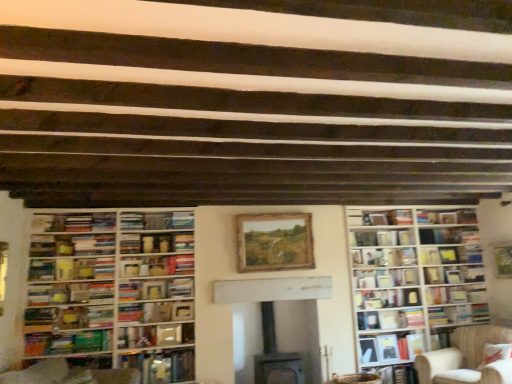
What do you see at coordinates (390, 347) in the screenshot? I see `hardcover book at lower right, placed as the 2th book when sorted from bottom to top` at bounding box center [390, 347].

Locate an element on the screen. Image resolution: width=512 pixels, height=384 pixels. hardcover book at lower right, which is the eleventh book in top-to-bottom order is located at coordinates (390, 347).

What are the coordinates of `beige fabric chair at lower right` in the screenshot? It's located at point(465,358).

Identify the location of wooden-framed painting at center, positioned as the 2th picture frame in right-to-left order. (274, 242).

You are a GUI agent. You are given a task and a screenshot of the screen. Output one action in this format:
    pyautogui.click(x=<x>, y=<y>)
    Task: Click on the hardcover book at lower right, placed as the 2th book when sorted from bottom to top
    
    Given the screenshot: What is the action you would take?
    pyautogui.click(x=390, y=347)

From a real-world perspective, which object stands above the other?

hardcover book at center, which is counted as the first book, starting from the top, is physically above.

Is hardcover book at center, acting as the 10th book starting from the bottom, placed right next to hardcover book at center, which is counted as the first book, starting from the top?

hardcover book at center, acting as the 10th book starting from the bottom, is not next to hardcover book at center, which is counted as the first book, starting from the top, and they're not touching.

Who is bigger, hardcover book at center, acting as the 10th book starting from the bottom, or hardcover book at center, which is counted as the first book, starting from the top?

hardcover book at center, acting as the 10th book starting from the bottom, is bigger.

What's the angular difference between hardcover book at center, acting as the 10th book starting from the bottom, and hardcover book at center, which is counted as the first book, starting from the top,'s facing directions?

They differ by 1.3 degrees in their facing directions.

Is hardcover book at center, arranged as the eighth book when ordered from the bottom, wider or thinner than multicolored paperbacks at lower left, marked as the 7th book in a top-to-bottom arrangement?

Considering their sizes, hardcover book at center, arranged as the eighth book when ordered from the bottom, looks slimmer than multicolored paperbacks at lower left, marked as the 7th book in a top-to-bottom arrangement.

From the image's perspective, is hardcover book at center, the fifth book from the top, positioned above or below multicolored paperbacks at lower left, marked as the 7th book in a top-to-bottom arrangement?

hardcover book at center, the fifth book from the top, is situated higher than multicolored paperbacks at lower left, marked as the 7th book in a top-to-bottom arrangement, in the image.

Is hardcover book at center, arranged as the eighth book when ordered from the bottom, beside multicolored paperbacks at lower left, the 6th book ordered from the bottom?

No, hardcover book at center, arranged as the eighth book when ordered from the bottom, is not next to multicolored paperbacks at lower left, the 6th book ordered from the bottom.

From a real-world perspective, which is physically above, hardcover book at center, the fifth book from the top, or multicolored paperbacks at lower left, the 6th book ordered from the bottom?

hardcover book at center, the fifth book from the top, from a real-world perspective.

I want to click on the 9th book to the left of the beige fabric chair at lower right, starting your count from the anchor, so click(132, 221).

From a real-world perspective, is hardcover book at center, which is counted as the first book, starting from the top, on beige fabric chair at lower right?

Yes, from a real-world perspective, hardcover book at center, which is counted as the first book, starting from the top, is over beige fabric chair at lower right

Which is less distant, (120, 226) or (460, 365)?

Point (120, 226).

Is hardcover book at center, which is counted as the first book, starting from the top, with beige fabric chair at lower right?

hardcover book at center, which is counted as the first book, starting from the top, and beige fabric chair at lower right are clearly separated.

How different are the orientations of wooden bookshelf at left, which appears as the second bookcase when viewed from the right, and hardcover book at lower right, which is the eleventh book in top-to-bottom order, in degrees?

5.98 degrees.

Identify the location of bookcase that is the 2nd one above the hardcover book at lower right, placed as the 2th book when sorted from bottom to top (from a real-world perspective). The width and height of the screenshot is (512, 384). (113, 292).

Could you tell me if wooden bookshelf at left, which appears as the second bookcase when viewed from the right, is facing hardcover book at lower right, placed as the 2th book when sorted from bottom to top?

No.

Is wooden bookshelf at left, acting as the 1th bookcase starting from the left, thinner than hardcover book at lower right, which is the eleventh book in top-to-bottom order?

In fact, wooden bookshelf at left, acting as the 1th bookcase starting from the left, might be wider than hardcover book at lower right, which is the eleventh book in top-to-bottom order.

Is hardcover book at lower right, which ranks as the 12th book in top-to-bottom order, positioned far away from wooden picture frame at center, the second picture frame viewed from the left?

Indeed, hardcover book at lower right, which ranks as the 12th book in top-to-bottom order, is not near wooden picture frame at center, the second picture frame viewed from the left.

Considering the sizes of hardcover book at lower right, which ranks as the 12th book in top-to-bottom order, and wooden picture frame at center, which ranks as the 1th picture frame in right-to-left order, in the image, is hardcover book at lower right, which ranks as the 12th book in top-to-bottom order, taller or shorter than wooden picture frame at center, which ranks as the 1th picture frame in right-to-left order,?

Clearly, hardcover book at lower right, which ranks as the 12th book in top-to-bottom order, is shorter compared to wooden picture frame at center, which ranks as the 1th picture frame in right-to-left order.

Does hardcover book at lower right, which ranks as the 12th book in top-to-bottom order, have a larger size compared to wooden picture frame at center, the second picture frame viewed from the left?

Yes, hardcover book at lower right, which ranks as the 12th book in top-to-bottom order, is bigger than wooden picture frame at center, the second picture frame viewed from the left.

Is hardcover book at lower right, placed as the first book when sorted from bottom to top, oriented away from wooden picture frame at center, which ranks as the 1th picture frame in right-to-left order?

hardcover book at lower right, placed as the first book when sorted from bottom to top, does not have its back to wooden picture frame at center, which ranks as the 1th picture frame in right-to-left order.

Is hardcover book at lower right, which is the eleventh book in top-to-bottom order, situated inside hardcover book at center, arranged as the eighth book when ordered from the bottom, or outside?

hardcover book at lower right, which is the eleventh book in top-to-bottom order, is not enclosed by hardcover book at center, arranged as the eighth book when ordered from the bottom.

From the image's perspective, is hardcover book at lower right, which is the eleventh book in top-to-bottom order, located above or below hardcover book at center, arranged as the eighth book when ordered from the bottom?

hardcover book at lower right, which is the eleventh book in top-to-bottom order, is below hardcover book at center, arranged as the eighth book when ordered from the bottom.

Which object is positioned more to the right, hardcover book at lower right, which is the eleventh book in top-to-bottom order, or hardcover book at center, arranged as the eighth book when ordered from the bottom?

Positioned to the right is hardcover book at lower right, which is the eleventh book in top-to-bottom order.

Considering the points (361, 337) and (401, 296), which point is in front, point (361, 337) or point (401, 296)?

The point (361, 337) is more forward.

Does hardcover book at lower right, placed as the first book when sorted from bottom to top, appear on the right side of white glossy bookcase at right, which appears as the second bookcase when viewed from the left?

No, hardcover book at lower right, placed as the first book when sorted from bottom to top, is not to the right of white glossy bookcase at right, which appears as the second bookcase when viewed from the left.

Which of these two, hardcover book at lower right, placed as the first book when sorted from bottom to top, or white glossy bookcase at right, which appears as the second bookcase when viewed from the left, is bigger?

white glossy bookcase at right, which appears as the second bookcase when viewed from the left.

Is hardcover book at lower right, which ranks as the 12th book in top-to-bottom order, not close to white glossy bookcase at right, positioned as the 1th bookcase in right-to-left order?

No, there isn't a large distance between hardcover book at lower right, which ranks as the 12th book in top-to-bottom order, and white glossy bookcase at right, positioned as the 1th bookcase in right-to-left order.

Identify the location of the 7th book behind the hardcover book at center, which is the 12th book in bottom-to-top order. The image size is (512, 384). [x=381, y=238].

There is a multicolored paperbacks at lower left, marked as the 7th book in a top-to-bottom arrangement. Where is `the 3rd book above it (from a real-world perspective)`? The image size is (512, 384). the 3rd book above it (from a real-world perspective) is located at coordinates (387, 298).

Considering their positions, is multicolored paperbacks at lower left, the 6th book ordered from the bottom, positioned closer to hardcover book at center, the 4th book in the top-to-bottom sequence, than hardcover book at center, which is the 12th book in bottom-to-top order?

The object closer to hardcover book at center, the 4th book in the top-to-bottom sequence, is hardcover book at center, which is the 12th book in bottom-to-top order.

From the image, which object appears to be nearer to hardcover book at center, arranged as the eighth book when ordered from the bottom, hardcover book at center, the ninth book when ordered from bottom to top, or hardcover book at center, which is the 12th book in bottom-to-top order?

hardcover book at center, the ninth book when ordered from bottom to top.

Looking at the image, which one is located further to wooden picture frame at center, the second picture frame viewed from the left, multicolored paperbacks at lower left, marked as the 7th book in a top-to-bottom arrangement, or hardcover book at center, the fifth book from the top?

multicolored paperbacks at lower left, marked as the 7th book in a top-to-bottom arrangement, is further to wooden picture frame at center, the second picture frame viewed from the left.

Estimate the real-world distances between objects in this image. Which object is further from hardcover book at center, the 4th book in the top-to-bottom sequence, wooden bookshelf at left, which appears as the second bookcase when viewed from the right, or hardcover book at center, the ninth book positioned from the top?

wooden bookshelf at left, which appears as the second bookcase when viewed from the right, is further to hardcover book at center, the 4th book in the top-to-bottom sequence.

Estimate the real-world distances between objects in this image. Which object is further from wooden bookshelf at left, acting as the 1th bookcase starting from the left, hardcover book at center, arranged as the eighth book when ordered from the bottom, or wooden-framed painting at center, positioned as the 2th picture frame in right-to-left order?

Based on the image, hardcover book at center, arranged as the eighth book when ordered from the bottom, appears to be further to wooden bookshelf at left, acting as the 1th bookcase starting from the left.

When comparing their distances from wooden-framed painting at center, which appears as the first picture frame when viewed from the left, does hardcover book at center, the 4th book ordered from the bottom, or hardcover book at center, the 4th book in the top-to-bottom sequence, seem further?

hardcover book at center, the 4th book ordered from the bottom, is further to wooden-framed painting at center, which appears as the first picture frame when viewed from the left.

Considering their positions, is hardcover book at center, the ninth book positioned from the top, positioned closer to hardcover book at center, which is counted as the first book, starting from the top, than hardcover book at lower right, placed as the first book when sorted from bottom to top?

Based on the image, hardcover book at center, the ninth book positioned from the top, appears to be nearer to hardcover book at center, which is counted as the first book, starting from the top.

Which object lies nearer to the anchor point multicolored paperbacks at lower left, marked as the 7th book in a top-to-bottom arrangement, hardcover book at center, the 4th book in the top-to-bottom sequence, or white glossy bookcase at right, which appears as the second bookcase when viewed from the left?

Among the two, hardcover book at center, the 4th book in the top-to-bottom sequence, is located nearer to multicolored paperbacks at lower left, marked as the 7th book in a top-to-bottom arrangement.

Find the location of `picture frame between hardcover book at left, placed as the 2th book when sorted from top to bottom, and hardcover book at center, the third book positioned from the top`. picture frame between hardcover book at left, placed as the 2th book when sorted from top to bottom, and hardcover book at center, the third book positioned from the top is located at coordinates (274, 242).

Locate an element on the screen. This screenshot has height=384, width=512. bookcase between multicolored paperbacks at lower left, marked as the 7th book in a top-to-bottom arrangement, and hardcover book at center, the fifth book from the top is located at coordinates (113, 292).

Locate an element on the screen. The width and height of the screenshot is (512, 384). bookcase between hardcover book at center, the fifth book from the top, and hardcover books at center, the 8th book from the top, from left to right is located at coordinates (415, 281).

Where is `bookcase between hardcover book at lower left, which ranks as the 10th book in top-to-bottom order, and beige fabric chair at lower right, in the horizontal direction`? The width and height of the screenshot is (512, 384). bookcase between hardcover book at lower left, which ranks as the 10th book in top-to-bottom order, and beige fabric chair at lower right, in the horizontal direction is located at coordinates (415, 281).